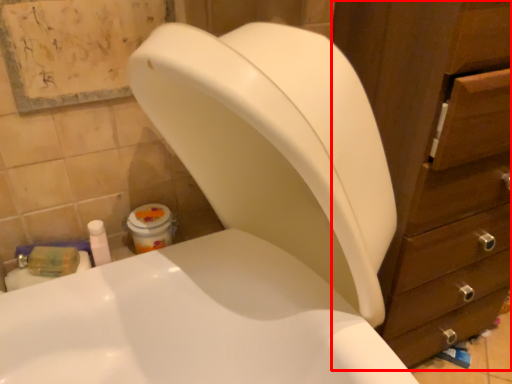
Question: Considering the relative positions of cabinet (annotated by the red box) and toiletry in the image provided, where is cabinet (annotated by the red box) located with respect to the staircase?

Choices:
 (A) right
 (B) left

Answer: (A)